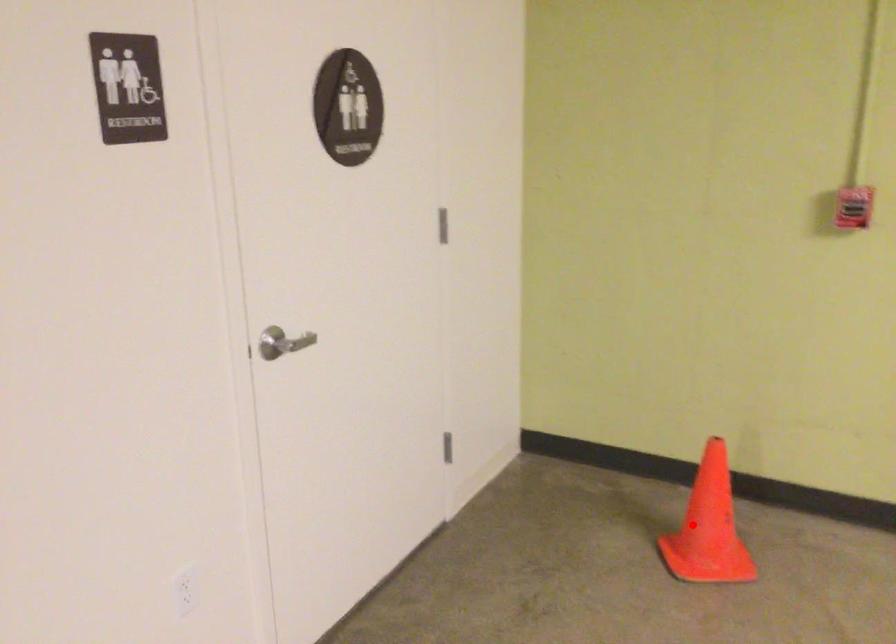
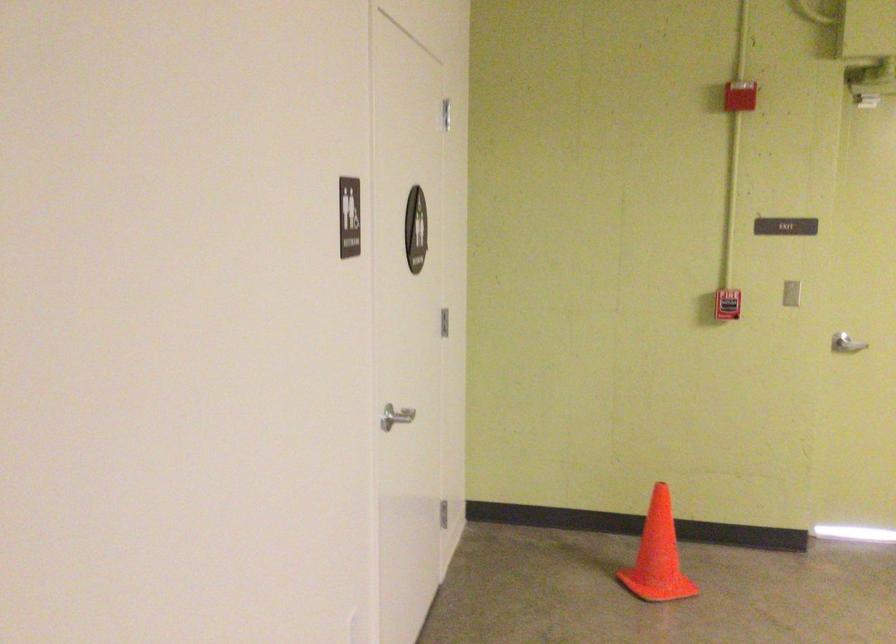
Where in the second image is the point corresponding to the highlighted location from the first image?

(658, 556)